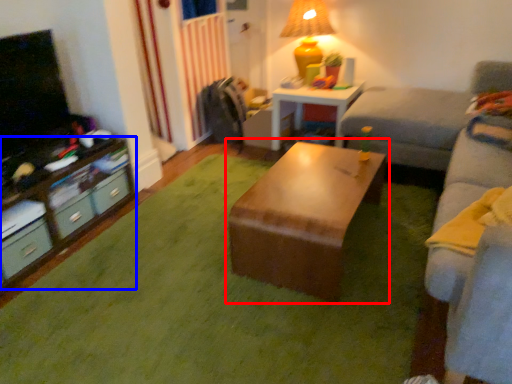
Question: Among these objects, which one is farthest to the camera, table (highlighted by a red box) or desk (highlighted by a blue box)?

Choices:
 (A) table
 (B) desk

Answer: (B)